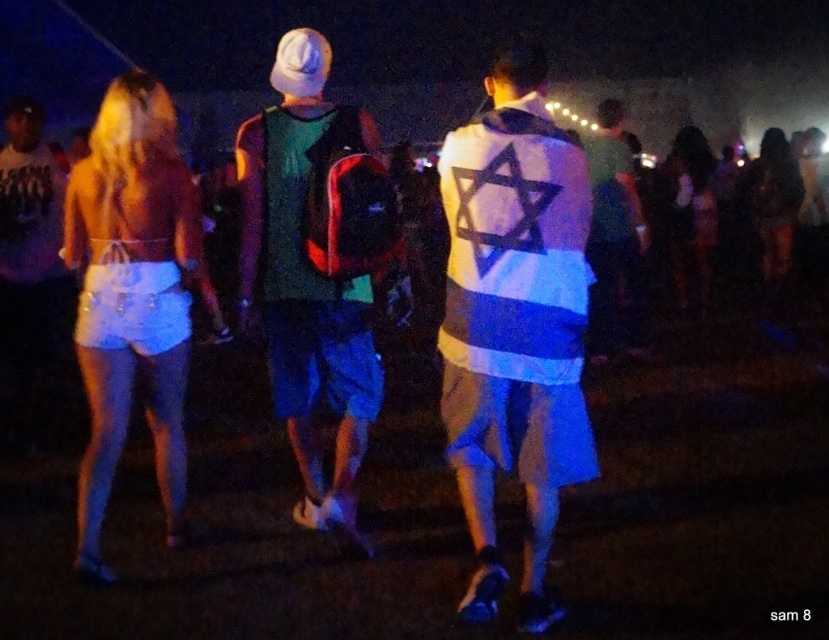
You are at the festival and want to take a photo of both the point at (347, 419) and the point at (115, 371). Which point should you stand closer to in order to capture both in a single frame?

You should stand closer to the point at (115, 371) because point at (347, 419) is behind it, so keeping the closer point in front will allow both to be in the frame.